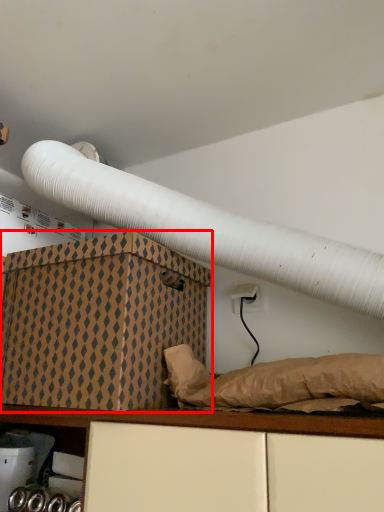
Question: From the image, what is the correct spatial relationship of box (annotated by the red box) in relation to shelf?

Choices:
 (A) right
 (B) left

Answer: (A)